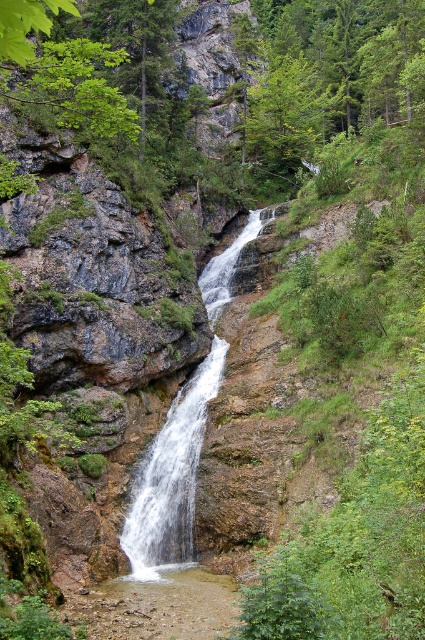
You are standing at the base of the waterfall and looking up at the rock face. There are two points marked on the cliff wall. The first point is located at coordinates point (x=181, y=556), and the second point is at point (x=184, y=467). Which of these two points is nearer to your viewpoint?

Point (x=181, y=556) is closer to the camera than point (x=184, y=467), so the first point is nearer to your viewpoint.

Consider the image. You are standing at the base of the waterfall and want to climb up to the top. You notice two sections of the waterfall structure. One is the white frothy water at center and the other is the white smooth waterfall at center. Which section would be easier to climb over?

The white smooth waterfall at center would be easier to climb over because the white frothy water at center is located above it, indicating that the smooth section is lower and possibly has a more stable surface.